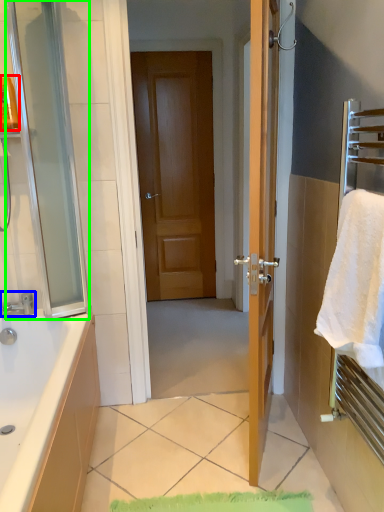
Question: Which is nearer to the toiletry (highlighted by a red box)? tap (highlighted by a blue box) or screen door (highlighted by a green box).

Choices:
 (A) tap
 (B) screen door

Answer: (B)